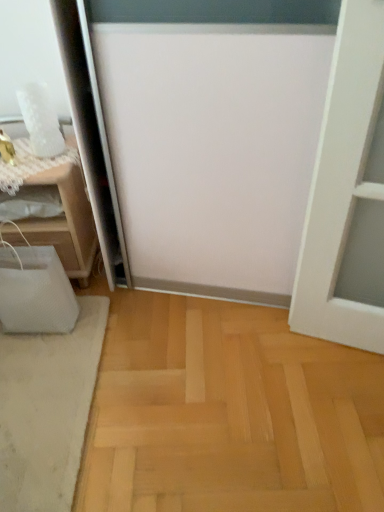
You are a GUI agent. You are given a task and a screenshot of the screen. Output one action in this format:
    pyautogui.click(x=<x>, y=<y>)
    Task: Click on the white mesh bag at left
    
    Given the screenshot: What is the action you would take?
    pyautogui.click(x=66, y=222)

The image size is (384, 512). What do you see at coordinates (66, 222) in the screenshot?
I see `white mesh bag at left` at bounding box center [66, 222].

Where is `white soft rug at lower left`? Image resolution: width=384 pixels, height=512 pixels. white soft rug at lower left is located at coordinates (47, 410).

Describe the element at coordinates (47, 410) in the screenshot. I see `white soft rug at lower left` at that location.

Identify the location of white mesh bag at left. (66, 222).

Can you confirm if white mesh bag at left is positioned to the right of white soft rug at lower left?

No, white mesh bag at left is not to the right of white soft rug at lower left.

Which object is more forward, white mesh bag at left or white soft rug at lower left?

white soft rug at lower left is in front.

Which point is more distant from viewer, (78, 205) or (33, 465)?

The point (78, 205) is behind.

From the image's perspective, is white mesh bag at left located beneath white soft rug at lower left?

No, from the image's perspective, white mesh bag at left is not beneath white soft rug at lower left.

From a real-world perspective, does white mesh bag at left sit lower than white soft rug at lower left?

Incorrect, from a real-world perspective, white mesh bag at left is higher than white soft rug at lower left.

Looking at this image, is white mesh bag at left wider or thinner than white soft rug at lower left?

white mesh bag at left is thinner than white soft rug at lower left.

From their relative heights in the image, would you say white mesh bag at left is taller or shorter than white soft rug at lower left?

In the image, white mesh bag at left appears to be taller than white soft rug at lower left.

Who is bigger, white mesh bag at left or white soft rug at lower left?

white mesh bag at left is bigger.

Based on the photo, is white soft rug at lower left completely or partially inside white mesh bag at left?

No, white soft rug at lower left is not surrounded by white mesh bag at left.

Is white mesh bag at left touching white soft rug at lower left?

white mesh bag at left is not next to white soft rug at lower left, and they're not touching.

Is white mesh bag at left oriented towards white soft rug at lower left?

Yes, white mesh bag at left is oriented towards white soft rug at lower left.

How many degrees apart are the facing directions of white mesh bag at left and white soft rug at lower left?

The facing directions of white mesh bag at left and white soft rug at lower left are 89.8 degrees apart.

Locate an element on the screen. doormat in front of the white mesh bag at left is located at coordinates (47, 410).

Between white soft rug at lower left and white mesh bag at left, which one appears on the left side from the viewer's perspective?

From the viewer's perspective, white mesh bag at left appears more on the left side.

Is white soft rug at lower left positioned before white mesh bag at left?

Yes, white soft rug at lower left is closer to the camera.

Which is in front, point (39, 356) or point (43, 230)?

Positioned in front is point (39, 356).

From the image's perspective, is white soft rug at lower left above white mesh bag at left?

No, from the image's perspective, white soft rug at lower left is not above white mesh bag at left.

From a real-world perspective, is white soft rug at lower left on white mesh bag at left?

Incorrect, from a real-world perspective, white soft rug at lower left is lower than white mesh bag at left.

Which object is wider, white soft rug at lower left or white mesh bag at left?

Wider between the two is white soft rug at lower left.

Between white soft rug at lower left and white mesh bag at left, which one has less height?

Standing shorter between the two is white soft rug at lower left.

In terms of size, does white soft rug at lower left appear bigger or smaller than white mesh bag at left?

Considering their sizes, white soft rug at lower left takes up less space than white mesh bag at left.

Is white mesh bag at left located within white soft rug at lower left?

No, white mesh bag at left is not inside white soft rug at lower left.

Is white soft rug at lower left next to white mesh bag at left?

white soft rug at lower left and white mesh bag at left are clearly separated.

Is white soft rug at lower left aimed at white mesh bag at left?

No, white soft rug at lower left is not facing towards white mesh bag at left.

Can you tell me how much white soft rug at lower left and white mesh bag at left differ in facing direction?

They differ by 89.8 degrees in their facing directions.

Locate an element on the screen. doormat that appears on the right of white mesh bag at left is located at coordinates (47, 410).

At what (x,y) coordinates should I click in order to perform the action: click on doormat below the white mesh bag at left (from a real-world perspective). Please return your answer as a coordinate pair (x, y). This screenshot has width=384, height=512. Looking at the image, I should click on (47, 410).

Where is `doormat in front of the white mesh bag at left`? This screenshot has width=384, height=512. doormat in front of the white mesh bag at left is located at coordinates (47, 410).